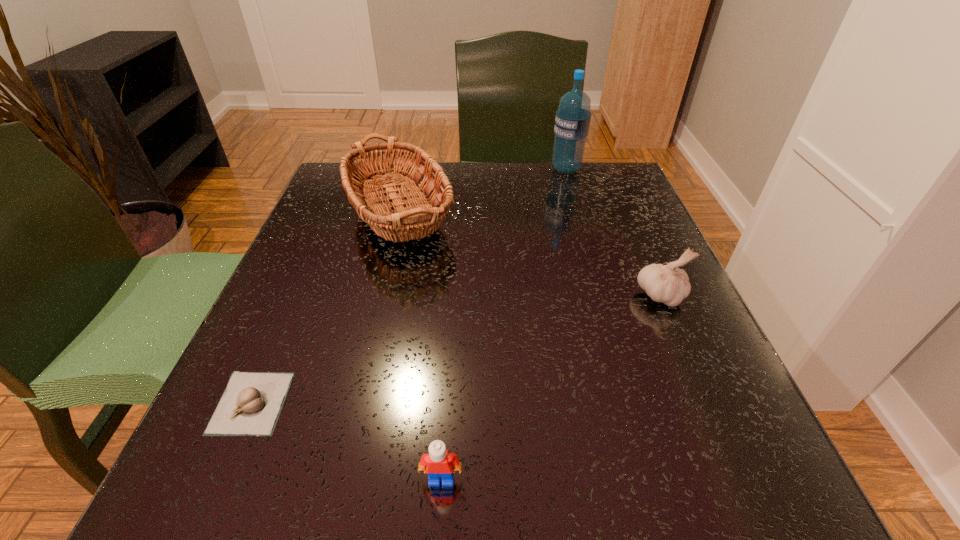
This screenshot has width=960, height=540. In order to click on the tallest object in this screenshot , I will do [572, 122].

This screenshot has width=960, height=540. I want to click on water bottle, so click(572, 122).

Find the location of a particular element. basket is located at coordinates (412, 219).

Locate an element on the screen. This screenshot has height=540, width=960. the taller garlic is located at coordinates (666, 283).

You are a GUI agent. You are given a task and a screenshot of the screen. Output one action in this format:
    pyautogui.click(x=<x>, y=<y>)
    Task: Click on the third tallest object
    The height and width of the screenshot is (540, 960).
    Given the screenshot: What is the action you would take?
    pos(666,283)

At what (x,y) coordinates should I click in order to perform the action: click on the second shortest object. Please return your answer as a coordinate pair (x, y). Looking at the image, I should click on (439, 462).

Where is `the nearest object`? This screenshot has width=960, height=540. the nearest object is located at coordinates tap(439, 462).

At what (x,y) coordinates should I click in order to perform the action: click on the left garlic. Please return your answer as a coordinate pair (x, y). The height and width of the screenshot is (540, 960). Looking at the image, I should click on (251, 403).

Locate an element on the screen. This screenshot has height=540, width=960. the shortest object is located at coordinates pyautogui.click(x=251, y=403).

Identify the location of free region located on the left of the water bottle. (498, 169).